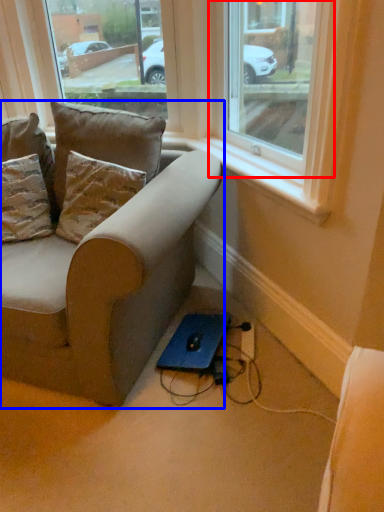
Question: Which object is further to the camera taking this photo, window (highlighted by a red box) or studio couch (highlighted by a blue box)?

Choices:
 (A) window
 (B) studio couch

Answer: (B)